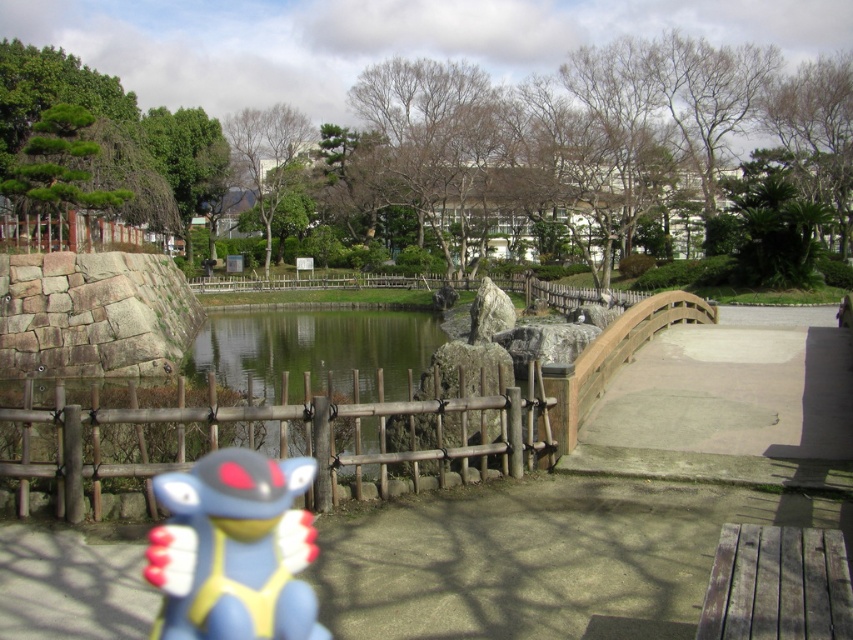
You are standing at the wooden fence near the blue character with red gloves and yellow accents. You want to walk towards the curved wooden bridge. Which point, point (x=213, y=637) or point (x=389, y=348), is closer to your starting position?

Point (x=213, y=637) is closer to your starting position because it is in front of point (x=389, y=348).

You are standing at the point with coordinates (277, 436) in the park scene. What object are you directly facing?

The point at (277, 436) corresponds to the wooden fence at center, so you are directly facing the wooden fence at center.

You are standing at the center of the curved wooden bridge in the park. You see a blue rubber toy at lower left. Which direction should you walk to reach it?

You should walk towards the lower left direction to reach the blue rubber toy at lower left since it is located at point [234,548].